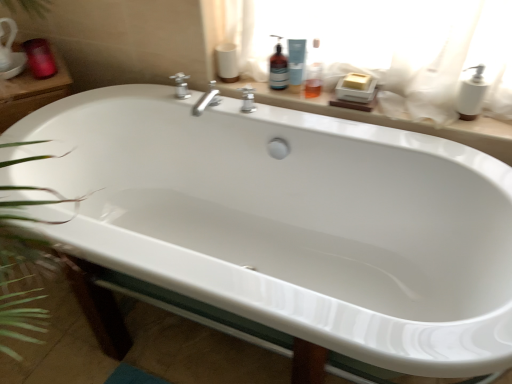
Image resolution: width=512 pixels, height=384 pixels. I want to click on vacant space situated above matte beige soap dish at upper center (from a real-world perspective), so click(x=360, y=106).